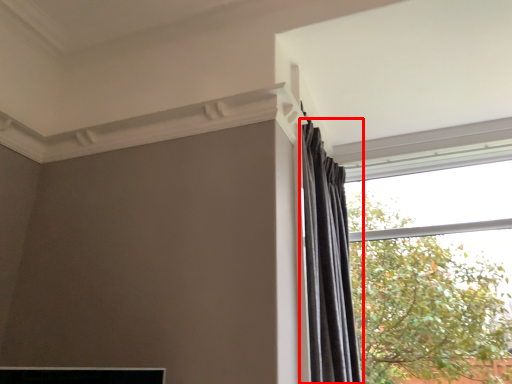
Question: From the image, what is the correct spatial relationship of curtain (annotated by the red box) in relation to window?

Choices:
 (A) left
 (B) right

Answer: (A)